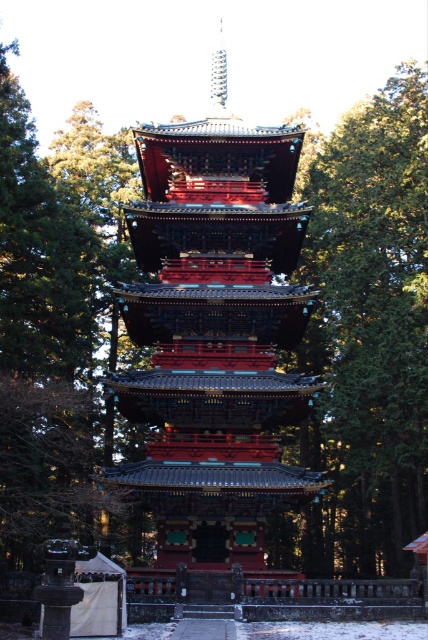
You are a photographer planning to capture the shiny lacquered pagoda at center and the green textured tree at center in a single frame. Based on their sizes in the image, which object would appear smaller in the final photo?

The shiny lacquered pagoda at center appears smaller in the final photo because it is shorter than the green textured tree at center.

You are standing at the point marked by coordinates point [214,333]. Looking around, you see the shiny lacquered pagoda at center. Which direction should you face to look directly at the pagoda?

Since the point [214,333] marks the shiny lacquered pagoda at center, you are already facing the pagoda directly. There is no need to change direction.